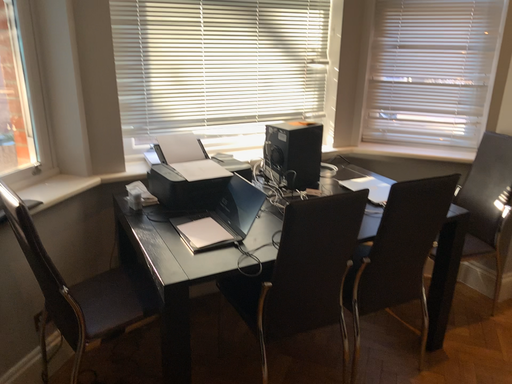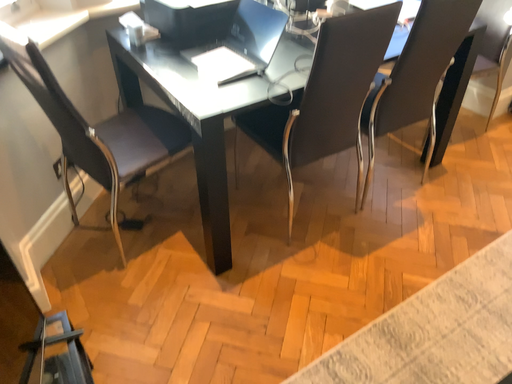
Question: Which way did the camera rotate in the video?

Choices:
 (A) rotated downward
 (B) rotated upward

Answer: (A)